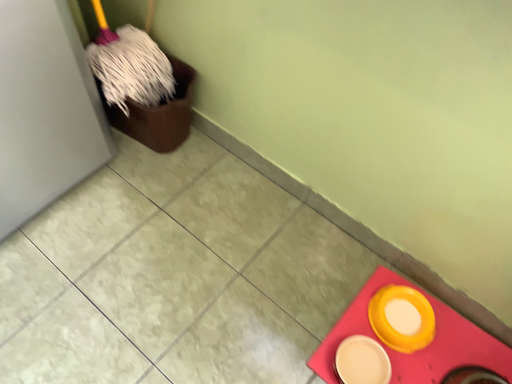
This screenshot has height=384, width=512. In order to click on free spot to the right of matte yellow plate at lower right, which ranks as the 2th tableware in right-to-left order in this screenshot , I will do `click(429, 358)`.